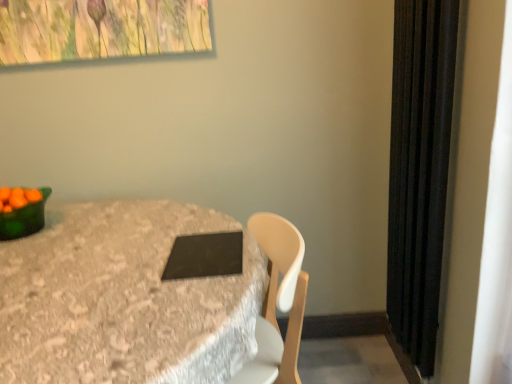
Locate an element on the screen. vacant area in front of green glossy bowl at left is located at coordinates (26, 251).